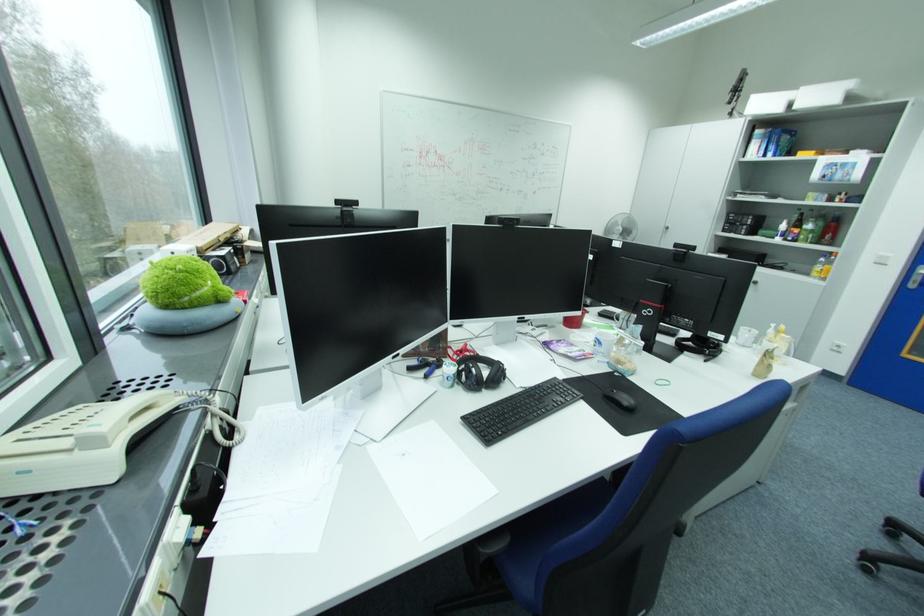
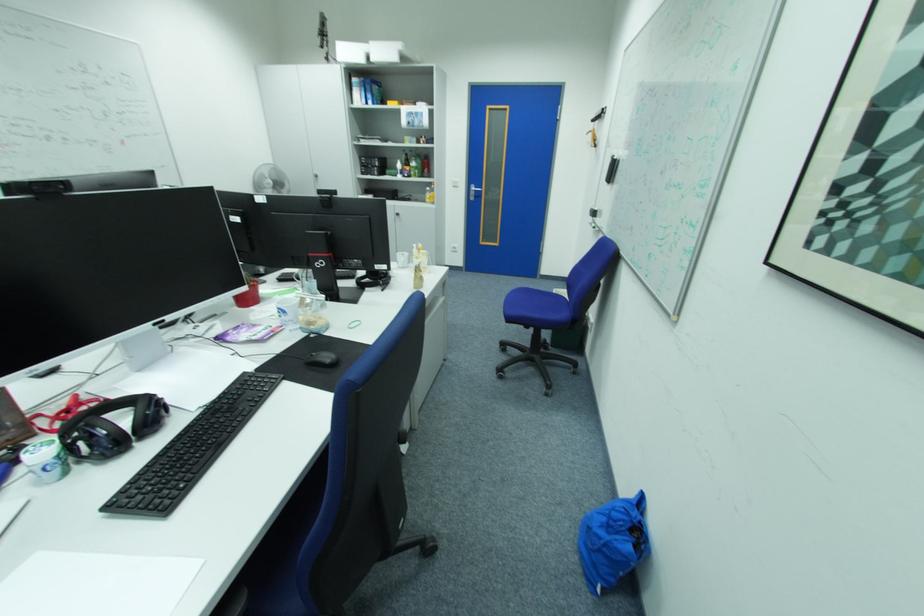
Question: The camera is either moving clockwise (left) or counter-clockwise (right) around the object. The first image is from the beginning of the video and the second image is from the end. Is the camera moving left or right when shooting the video?

Choices:
 (A) Left
 (B) Right

Answer: (A)